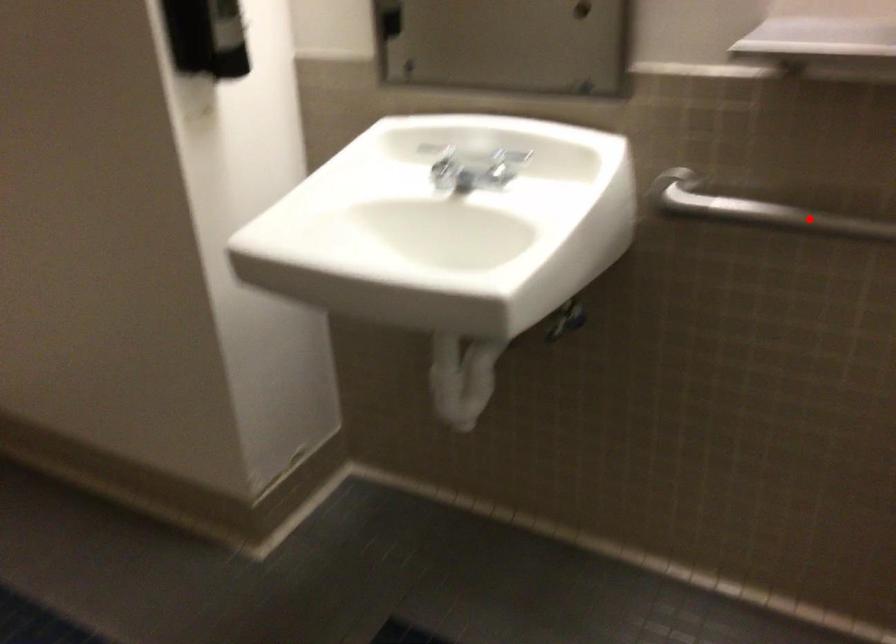
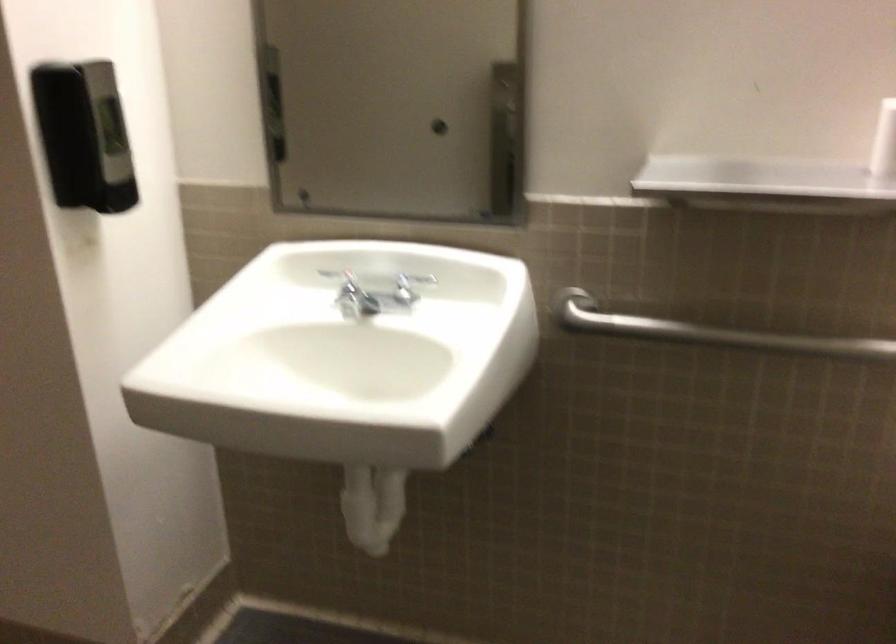
The point at the highlighted location is marked in the first image. Where is the corresponding point in the second image?

(707, 332)